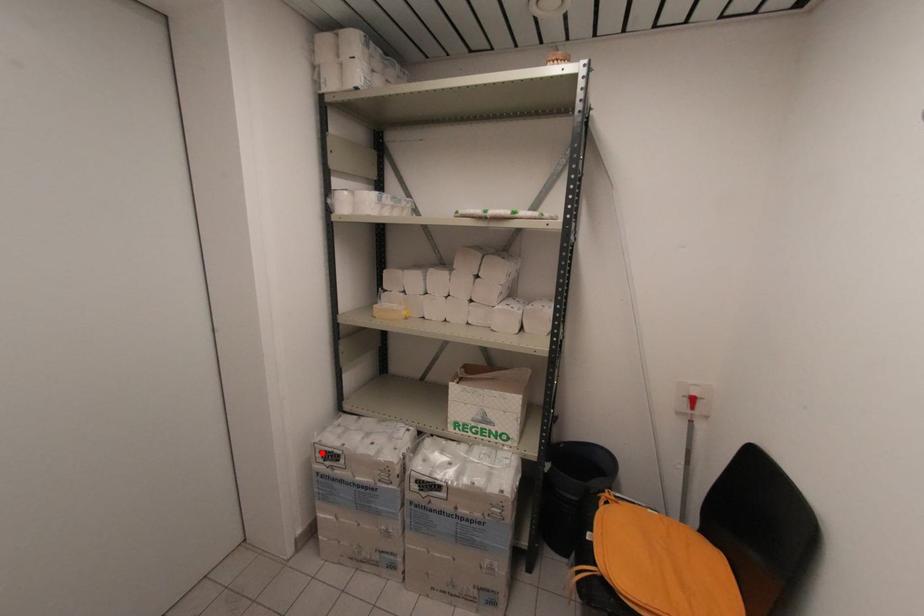
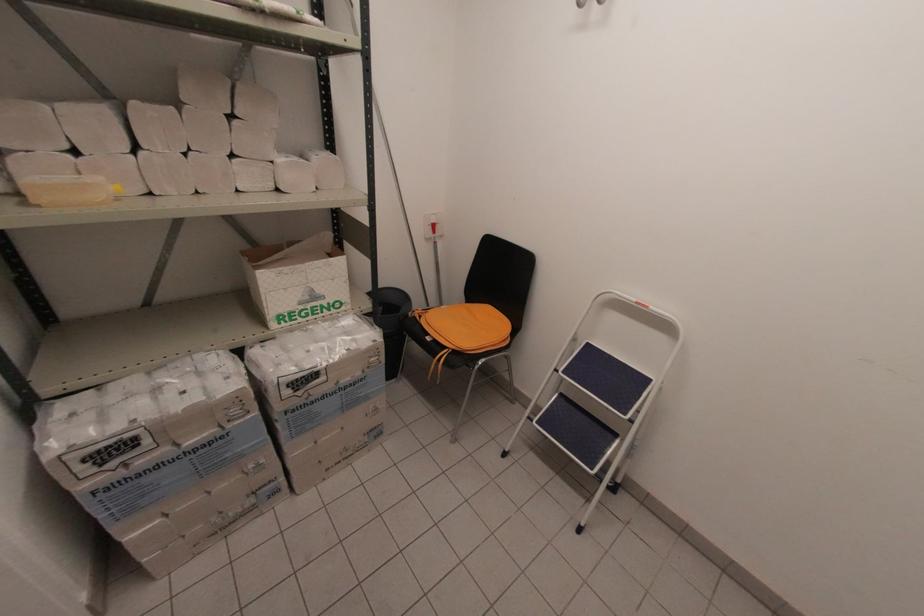
Question: I am providing you with two images of the same scene from different viewpoints. Given a red point in image1, look at the same physical point in image2. Is it:

Choices:
 (A) Closer to the viewpoint
 (B) Farther from the viewpoint

Answer: (A)